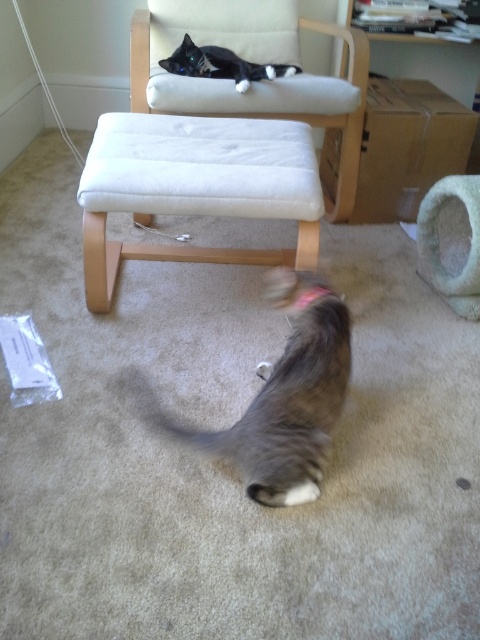
Does white fabric stool at center appear on the right side of light beige fabric armchair at upper center?

Incorrect, white fabric stool at center is not on the right side of light beige fabric armchair at upper center.

Is point (192, 161) positioned before point (257, 52)?

Yes.

Who is more distant from viewer, (109, 276) or (359, 72)?

Point (359, 72)

The height and width of the screenshot is (640, 480). What are the coordinates of `white fabric stool at center` in the screenshot? It's located at (193, 184).

Is white fabric stool at center thinner than gray striped cat at lower center?

No, white fabric stool at center is not thinner than gray striped cat at lower center.

Is point (250, 122) in front of point (299, 493)?

No.

Does point (144, 182) lie in front of point (206, 432)?

That is False.

Find the location of `white fabric stool at center`. white fabric stool at center is located at coordinates (193, 184).

Is the position of white fabric stool at center less distant than that of soft green fabric cat bed at lower right?

Yes.

Is white fabric stool at center to the left of soft green fabric cat bed at lower right from the viewer's perspective?

Yes, white fabric stool at center is to the left of soft green fabric cat bed at lower right.

Between point (187, 257) and point (478, 202), which one is positioned in front?

Point (478, 202) is in front.

Find the location of a particular element. Image resolution: width=480 pixels, height=640 pixels. white fabric stool at center is located at coordinates (193, 184).